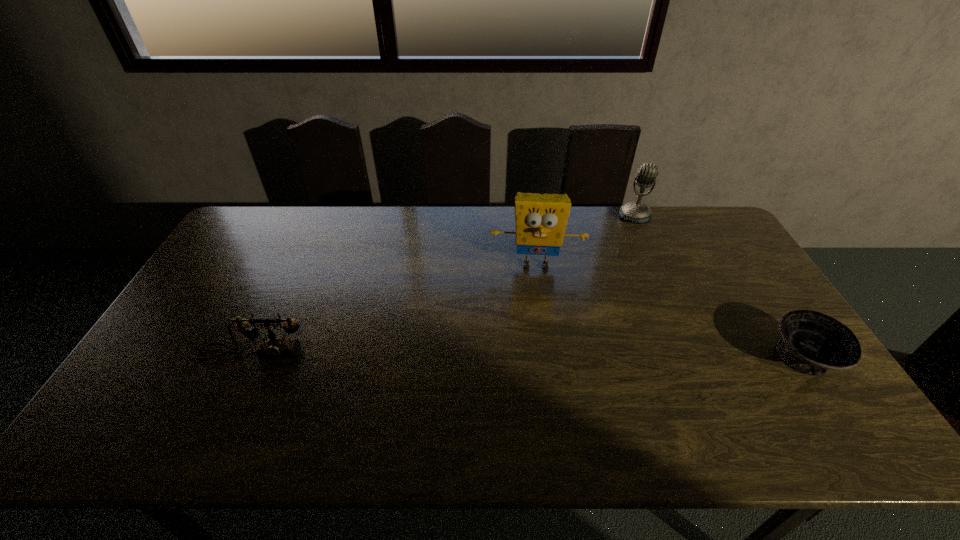
The height and width of the screenshot is (540, 960). Find the location of `vacant area that lies between the third tallest object and the second object from right to left`. vacant area that lies between the third tallest object and the second object from right to left is located at coordinates [444, 285].

Identify the location of free space between the second object from left to right and the farthest object. (586, 241).

Locate an element on the screen. free space between the microphone and the rightmost object is located at coordinates (719, 287).

This screenshot has width=960, height=540. In order to click on unoccupied area between the shortest object and the telephone in this screenshot , I will do `click(529, 356)`.

Where is `vacant space in between the second farthest object and the shortest object`? vacant space in between the second farthest object and the shortest object is located at coordinates (670, 312).

You are a GUI agent. You are given a task and a screenshot of the screen. Output one action in this format:
    pyautogui.click(x=<x>, y=<y>)
    Task: Click on the free point between the leftmost object and the sponge
    
    Given the screenshot: What is the action you would take?
    pyautogui.click(x=395, y=309)

Identify the location of empty location between the bowl and the leftmost object. The image size is (960, 540). (529, 356).

The height and width of the screenshot is (540, 960). Identify the location of the third closest object to the third object from right to left. (275, 347).

Point out which object is positioned as the second nearest to the third nearest object. Please provide its 2D coordinates. Your answer should be formatted as a tuple, i.e. [(x, y)], where the tuple contains the x and y coordinates of a point satisfying the conditions above.

[(812, 343)]

Find the location of a particular element. vacant space that satisfies the following two spatial constraints: 1. on the front-facing side of the third tallest object; 2. on the left side of the rightmost object is located at coordinates (252, 358).